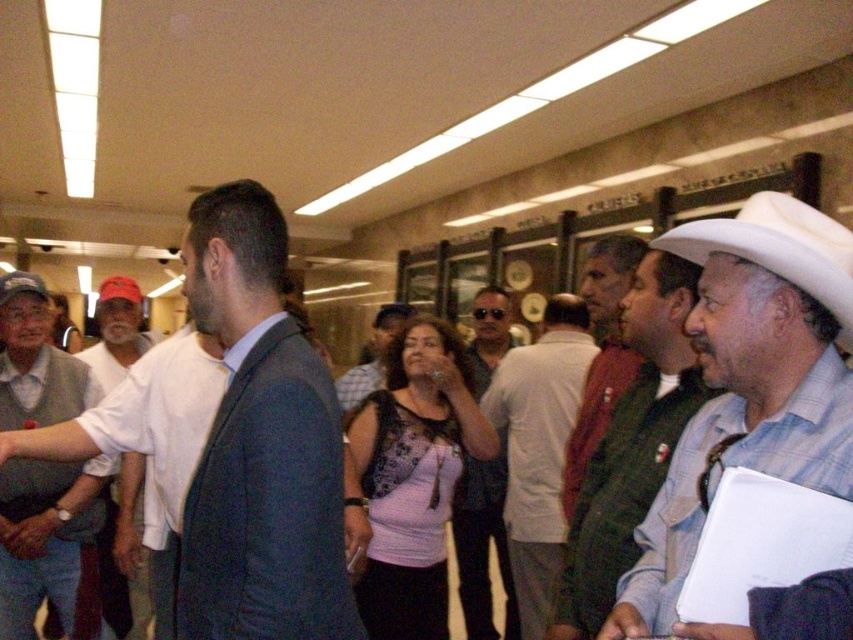
You are a photographer positioned at the back of the room. You want to take a photo of the matte pink blouse at center without the white matte hat at right appearing in the frame. Is this possible based on their positions?

The white matte hat at right is below the matte pink blouse at center, so if you position yourself to aim above the white matte hat at right, you can capture the matte pink blouse at center without the hat obstructing the view.

You are organizing a photo shoot and need to arrange two models wearing the matte gray shirt at center and the matte pink blouse at center. Since the space is limited, you want to place the narrower garment first. Which garment should you place first?

The matte gray shirt at center should be placed first because its width is less than the matte pink blouse at center, making it narrower and easier to fit into the limited space.

You are standing at the origin point in the scene. There are two points marked in the image. Which point is closer to you, point [527,380] or point [786,227]?

Point [786,227] is closer to you because it is in front of point [527,380].